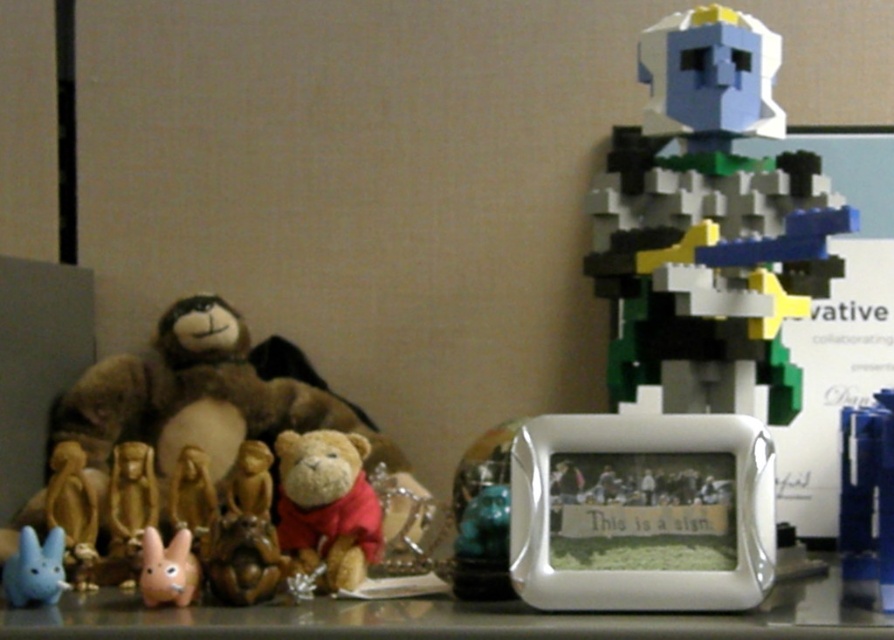
Question: Which object is closer to the camera taking this photo?

Choices:
 (A) pink matte rabbit at lower left
 (B) blue plastic pen at right
 (C) shiny metallic table at center

Answer: (C)

Question: Which of the following is the farthest from the observer?

Choices:
 (A) pink matte rabbit at lower left
 (B) shiny metallic table at center
 (C) blue plastic pen at right

Answer: (A)

Question: Is blue plastic pen at right to the left of pink matte rabbit at lower left from the viewer's perspective?

Choices:
 (A) no
 (B) yes

Answer: (A)

Question: Is shiny metallic table at center in front of blue plastic pen at right?

Choices:
 (A) yes
 (B) no

Answer: (A)

Question: Can you confirm if shiny metallic table at center is positioned below matte blue plush rabbit at lower left?

Choices:
 (A) yes
 (B) no

Answer: (A)

Question: Among these points, which one is farthest from the camera?

Choices:
 (A) (284, 486)
 (B) (892, 426)
 (C) (127, 497)
 (D) (30, 568)

Answer: (C)